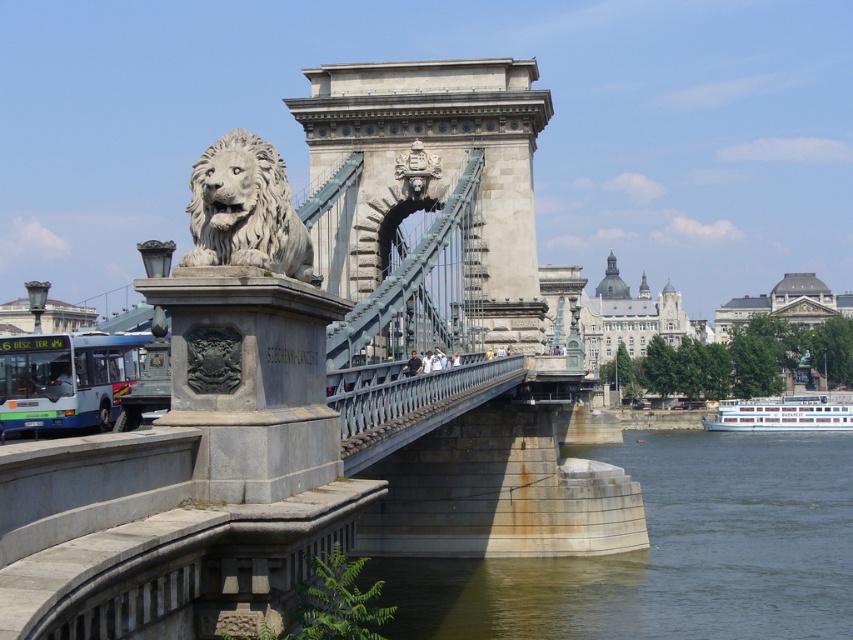
In the scene shown: You are a tourist standing in front of the white stone lion at upper left and want to cross the stone suspension bridge at center. Which direction should you walk to reach the bridge?

You should walk to the right from the white stone lion at upper left to reach the stone suspension bridge at center since the stone suspension bridge at center is located to the right of the white stone lion at upper left.

You are standing at the stone lion statue on the left side of the frame. If you look towards the point at coordinates (318, 388), what structure will you see in that direction?

The point at coordinates (318, 388) corresponds to the stone suspension bridge at center, so you will see the stone suspension bridge at center in that direction.